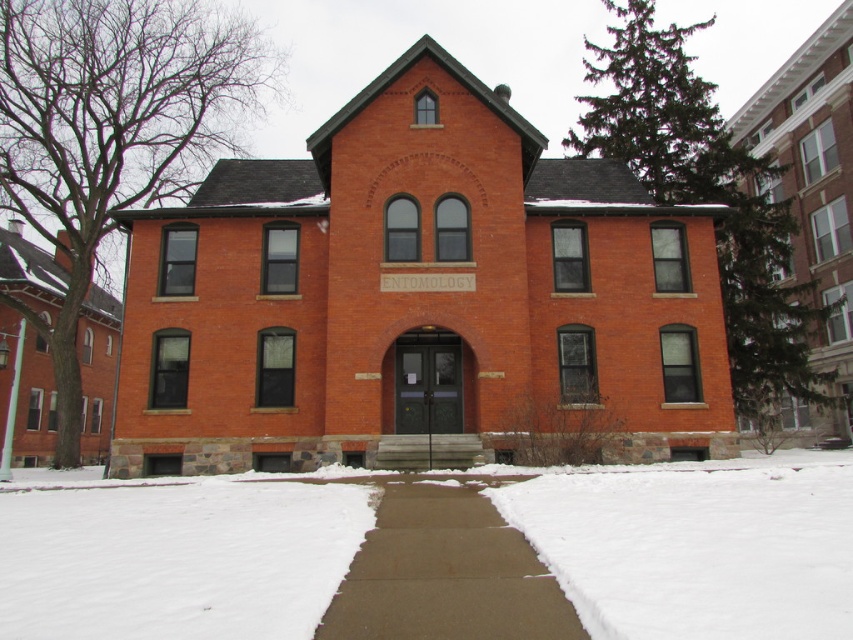
Between point (669, 536) and point (347, 480), which one is positioned in front?

Point (669, 536)

Does point (717, 632) lie in front of point (515, 564)?

That is True.

Locate an element on the screen. white powdery snow at center is located at coordinates (698, 547).

Find the location of a particular element. This screenshot has width=853, height=640. white powdery snow at center is located at coordinates (698, 547).